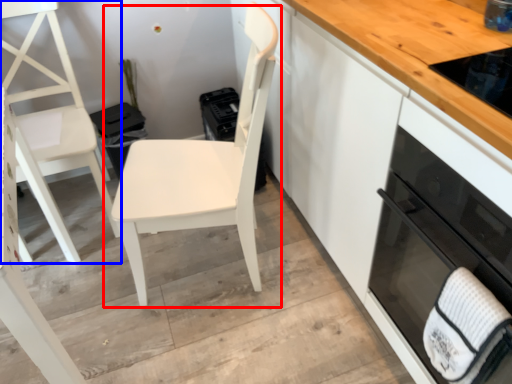
Question: Which object is closer to the camera taking this photo, chair (highlighted by a red box) or chair (highlighted by a blue box)?

Choices:
 (A) chair
 (B) chair

Answer: (A)